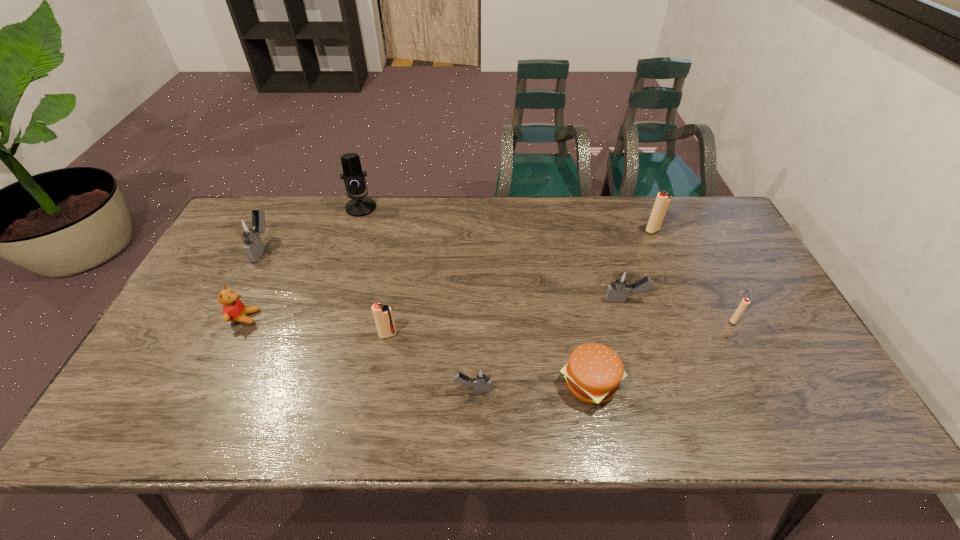
Locate an element on the screen. This screenshot has width=960, height=540. object at the far left corner is located at coordinates (249, 229).

Find the location of a particular element. The image size is (960, 540). free spot at the far edge of the desktop is located at coordinates (365, 217).

In the image, there is a desktop. Where is `vacant space at the near edge`? Image resolution: width=960 pixels, height=540 pixels. vacant space at the near edge is located at coordinates (613, 412).

You are a GUI agent. You are given a task and a screenshot of the screen. Output one action in this format:
    pyautogui.click(x=<x>, y=<y>)
    Task: Click on the vacant space at the left edge of the desktop
    The height and width of the screenshot is (540, 960).
    Given the screenshot: What is the action you would take?
    pyautogui.click(x=213, y=340)

At what (x,y) coordinates should I click in order to perform the action: click on blank area at the right edge. Please return your answer as a coordinate pair (x, y). Looking at the image, I should click on (809, 374).

You are a GUI agent. You are given a task and a screenshot of the screen. Output one action in this format:
    pyautogui.click(x=<x>, y=<y>)
    Task: Click on the vacant area at the far right corner
    This screenshot has height=540, width=960.
    Given the screenshot: What is the action you would take?
    pyautogui.click(x=711, y=226)

Image resolution: width=960 pixels, height=540 pixels. Find the location of `blank region between the second farthest gray igniter and the rightmost object`. blank region between the second farthest gray igniter and the rightmost object is located at coordinates (680, 310).

The height and width of the screenshot is (540, 960). In order to click on vacant point located between the fourth igniter from right to left and the seventh object from right to left in this screenshot , I will do `click(417, 298)`.

Locate an element on the screen. This screenshot has height=540, width=960. vacant area that lies between the rightmost red igniter and the biggest gray igniter is located at coordinates (498, 284).

Where is `empty space that is in between the hamburger and the red teddy bear`? The image size is (960, 540). empty space that is in between the hamburger and the red teddy bear is located at coordinates (418, 350).